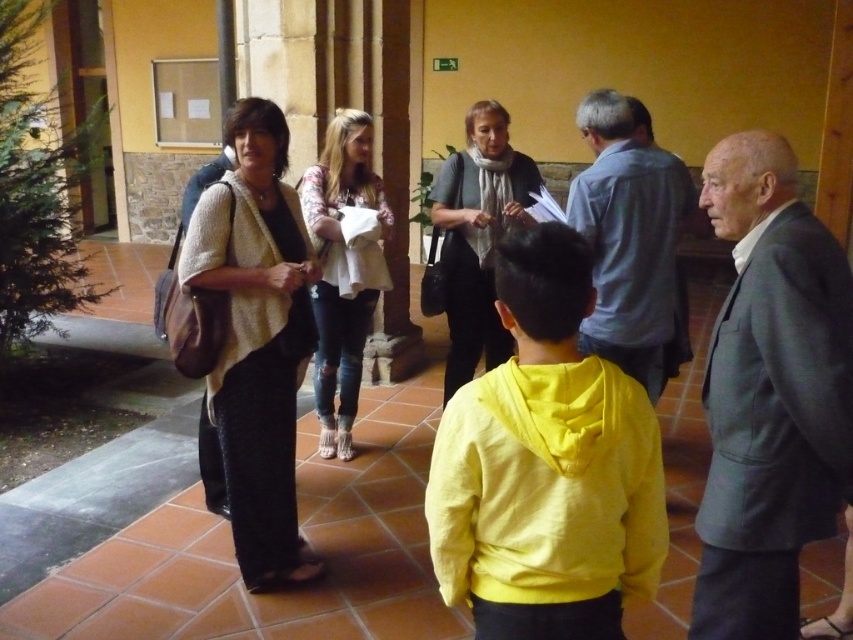
The width and height of the screenshot is (853, 640). What do you see at coordinates (770, 394) in the screenshot?
I see `gray wool suit at right` at bounding box center [770, 394].

Is point (769, 560) more distant than point (672, 257)?

No, (769, 560) is in front of (672, 257).

Is point (782, 616) more distant than point (590, 131)?

No, (782, 616) is closer to viewer.

Where is `gray wool suit at right`? gray wool suit at right is located at coordinates (770, 394).